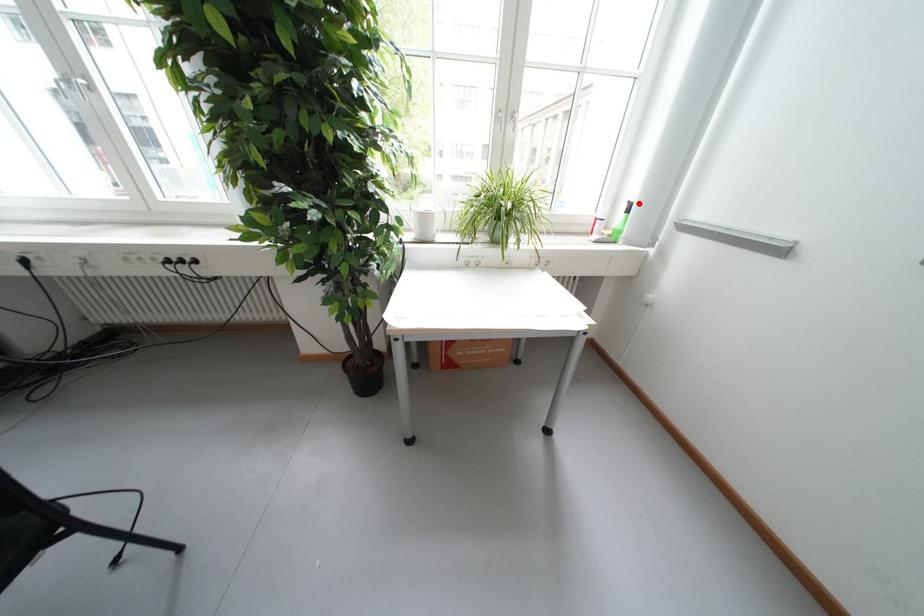
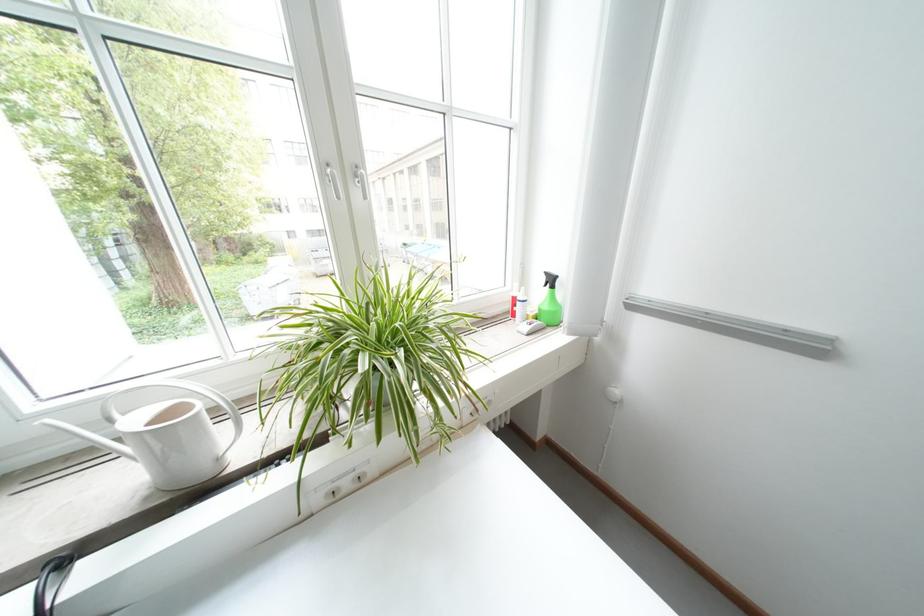
Question: I am providing you with two images of the same scene from different viewpoints. Given a red point in image1, look at the same physical point in image2. Is it:

Choices:
 (A) Closer to the viewpoint
 (B) Farther from the viewpoint

Answer: (B)